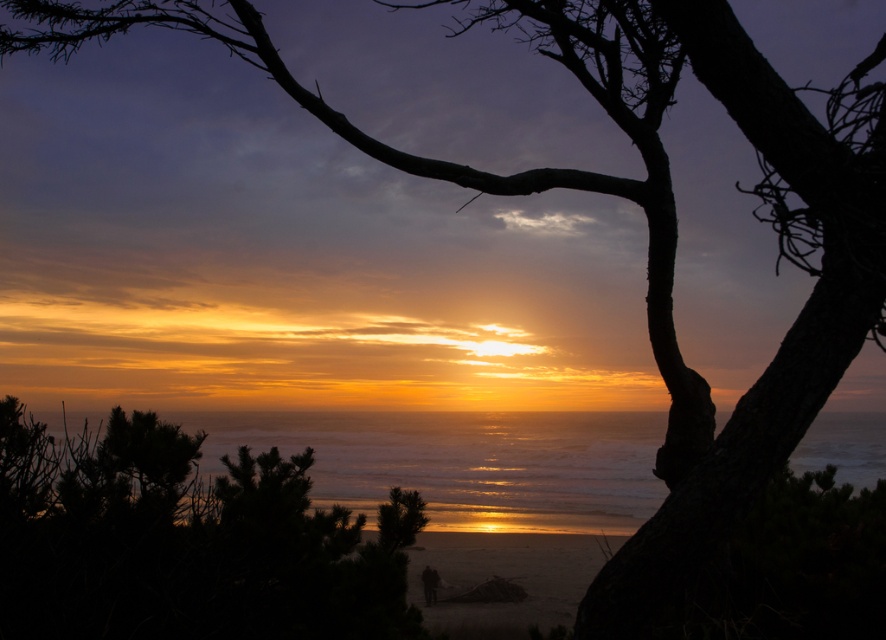
You are standing at the edge of the beach and want to place a 15 feet long wooden bench between the green leafy tree at center and the shiny metallic water at center. Will the bench fit between them without overlapping?

The distance between the green leafy tree at center and the shiny metallic water at center is 14.63 feet. Since the bench is 15 feet long, it will not fit between them without overlapping.

Based on the scene description, which object occupies more space in the image between the green leafy tree at center and the shiny metallic water at center?

The green leafy tree at center is larger in size than the shiny metallic water at center, so it occupies more space in the image.

Consider the image. You are standing on the beach and see the green leafy tree at center and the shiny metallic water at center. Which object is positioned higher in the scene?

The green leafy tree at center is located above the shiny metallic water at center, so it is positioned higher in the scene.